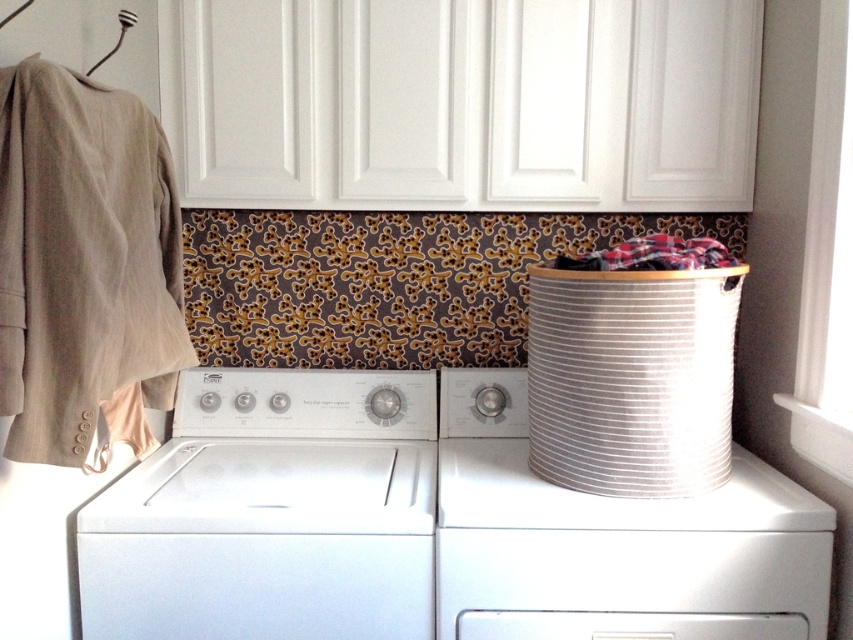
Is white plastic washing machine at center shorter than plaid fabric at center?

No.

Measure the distance between white plastic washing machine at center and plaid fabric at center.

white plastic washing machine at center is 28.68 inches away from plaid fabric at center.

The width and height of the screenshot is (853, 640). Describe the element at coordinates (271, 513) in the screenshot. I see `white plastic washing machine at center` at that location.

Where is `white plastic washing machine at center`? This screenshot has height=640, width=853. white plastic washing machine at center is located at coordinates (271, 513).

Who is shorter, white plastic washing machine at center or beige wool coat at left?

Standing shorter between the two is white plastic washing machine at center.

Can you confirm if white plastic washing machine at center is smaller than beige wool coat at left?

No, white plastic washing machine at center is not smaller than beige wool coat at left.

Does point (119, 516) come closer to viewer compared to point (1, 241)?

No, (119, 516) is behind (1, 241).

This screenshot has height=640, width=853. I want to click on white plastic washing machine at center, so click(271, 513).

Is beige wool coat at left positioned before metallic fork at upper left?

That is True.

Which is more to the left, beige wool coat at left or metallic fork at upper left?

From the viewer's perspective, metallic fork at upper left appears more on the left side.

Image resolution: width=853 pixels, height=640 pixels. I want to click on beige wool coat at left, so click(84, 266).

This screenshot has width=853, height=640. Identify the location of beige wool coat at left. (84, 266).